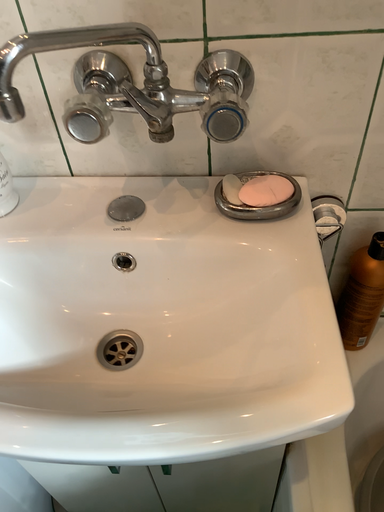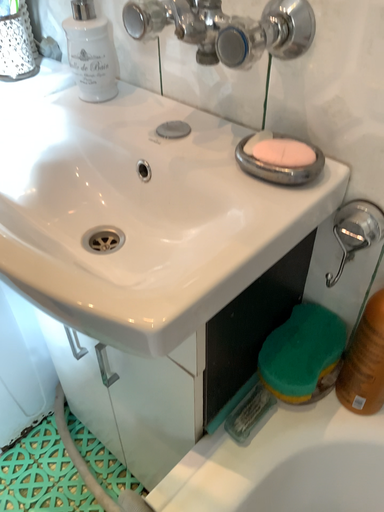
Question: How did the camera likely rotate when shooting the video?

Choices:
 (A) rotated upward
 (B) rotated downward

Answer: (A)